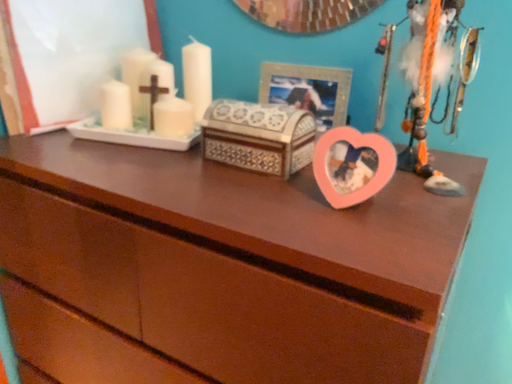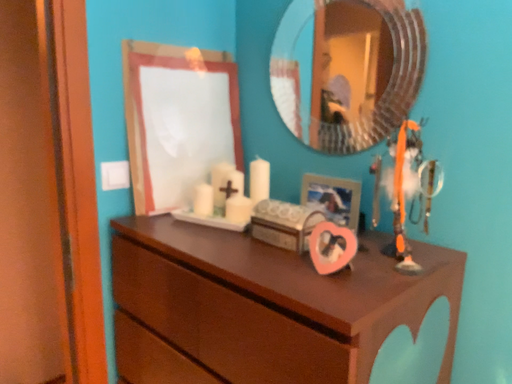
Question: Which way did the camera rotate in the video?

Choices:
 (A) rotated downward
 (B) rotated upward

Answer: (B)